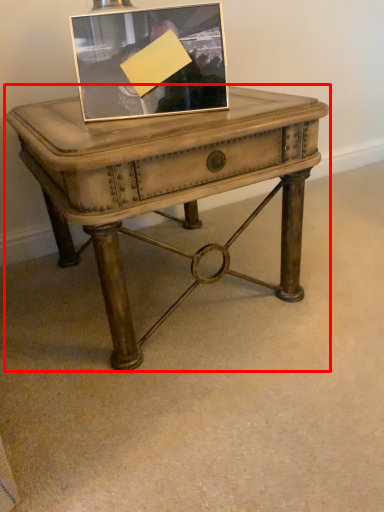
Question: From the image's perspective, where is table (annotated by the red box) located relative to picture frame?

Choices:
 (A) below
 (B) above

Answer: (A)